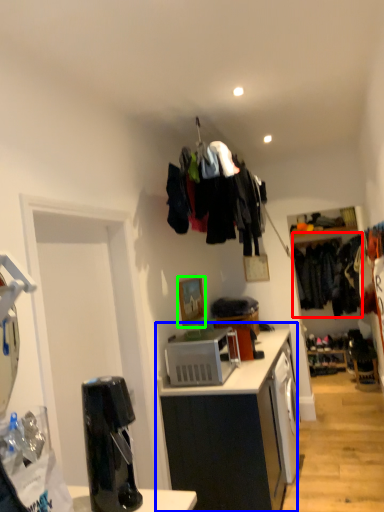
Question: Which object is the farthest from clothing (highlighted by a red box)? Choose among these: cabinetry (highlighted by a blue box) or picture frame (highlighted by a green box).

Choices:
 (A) cabinetry
 (B) picture frame

Answer: (A)